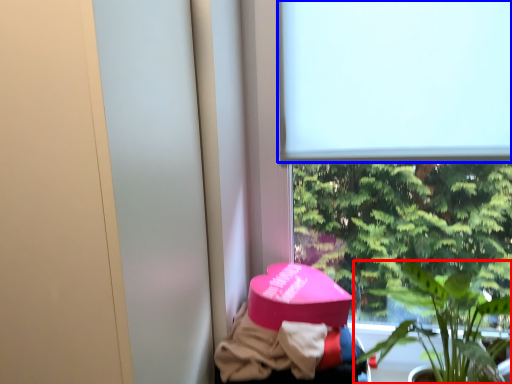
Question: Which of the following is the farthest to the observer, houseplant (highlighted by a red box) or window screen (highlighted by a blue box)?

Choices:
 (A) houseplant
 (B) window screen

Answer: (B)